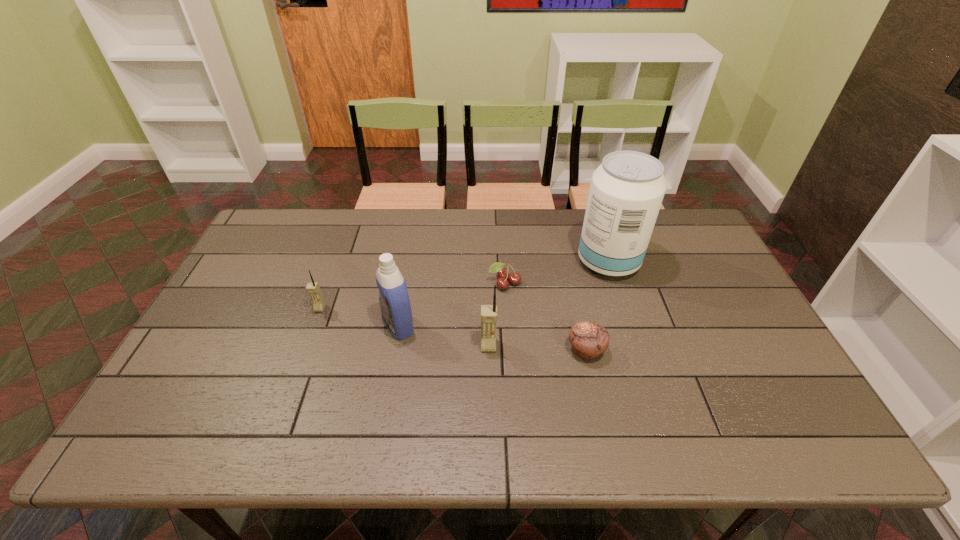
Where is `blank space at the far right corner`? blank space at the far right corner is located at coordinates (681, 248).

Where is `vacant space at the near right corner of the desktop`? The image size is (960, 540). vacant space at the near right corner of the desktop is located at coordinates (793, 388).

Find the location of a particular element. The width and height of the screenshot is (960, 540). unoccupied area between the detergent and the nearer cellular telephone is located at coordinates (444, 335).

Identify the location of vacant area that lies between the tallest object and the cherry. (557, 273).

At what (x,y) coordinates should I click in order to perform the action: click on free area in between the nearer cellular telephone and the fifth object from right to left. Please return your answer as a coordinate pair (x, y). Image resolution: width=960 pixels, height=540 pixels. Looking at the image, I should click on (444, 335).

Identify the location of vacant space that's between the taller cellular telephone and the fifth object from right to left. The image size is (960, 540). (444, 335).

The width and height of the screenshot is (960, 540). I want to click on vacant space that is in between the cherry and the muffin, so click(545, 317).

The height and width of the screenshot is (540, 960). Identify the location of vacant point located between the right cellular telephone and the muffin. (538, 348).

Where is `free space between the second object from left to right and the tallest object`? free space between the second object from left to right and the tallest object is located at coordinates (503, 293).

The width and height of the screenshot is (960, 540). In order to click on free spot between the alcohol and the leftmost object in this screenshot , I will do `click(464, 285)`.